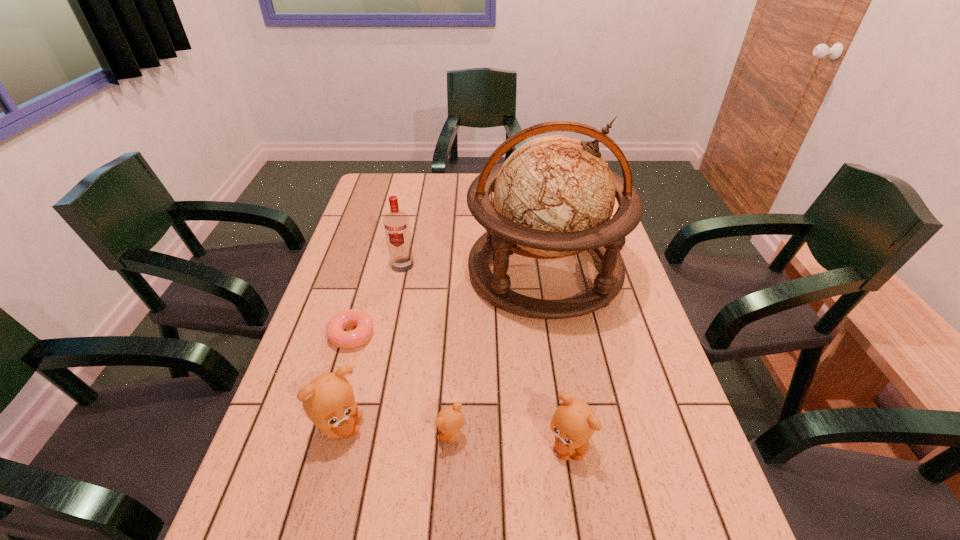
Find the location of a particular element. vacant space that is in between the doughnut and the fourth tallest object is located at coordinates (460, 389).

The height and width of the screenshot is (540, 960). What are the coordinates of `vacant region between the doughnut and the globe` in the screenshot? It's located at (448, 303).

At what (x,y) coordinates should I click in order to perform the action: click on the fourth closest object to the globe. Please return your answer as a coordinate pair (x, y). The image size is (960, 540). Looking at the image, I should click on (574, 422).

Image resolution: width=960 pixels, height=540 pixels. What are the coordinates of `object that is the fourth closest to the vodka` in the screenshot? It's located at (450, 420).

At what (x,y) coordinates should I click in order to perform the action: click on the closest teddy bear relative to the leftmost teddy bear. Please return your answer as a coordinate pair (x, y). The width and height of the screenshot is (960, 540). Looking at the image, I should click on [450, 420].

Identify the location of the closest teddy bear relative to the leftmost teddy bear. (450, 420).

Identify the location of free space that satisfies the following two spatial constraints: 1. on the front label of the tallest object; 2. on the left side of the fifth shortest object. (401, 272).

The width and height of the screenshot is (960, 540). I want to click on vacant space that satisfies the following two spatial constraints: 1. on the front label of the second tallest object; 2. on the face of the leftmost teddy bear, so click(x=369, y=428).